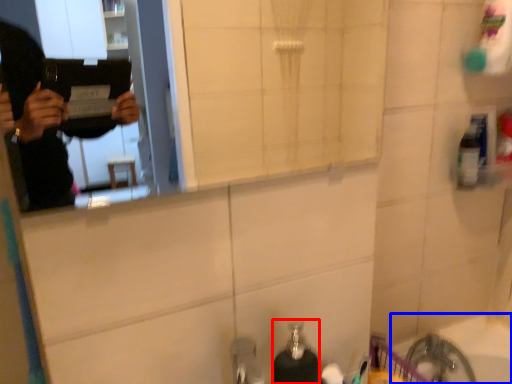
Question: Which object is closer to the camera taking this photo, soap dispenser (highlighted by a red box) or bath (highlighted by a blue box)?

Choices:
 (A) soap dispenser
 (B) bath

Answer: (A)